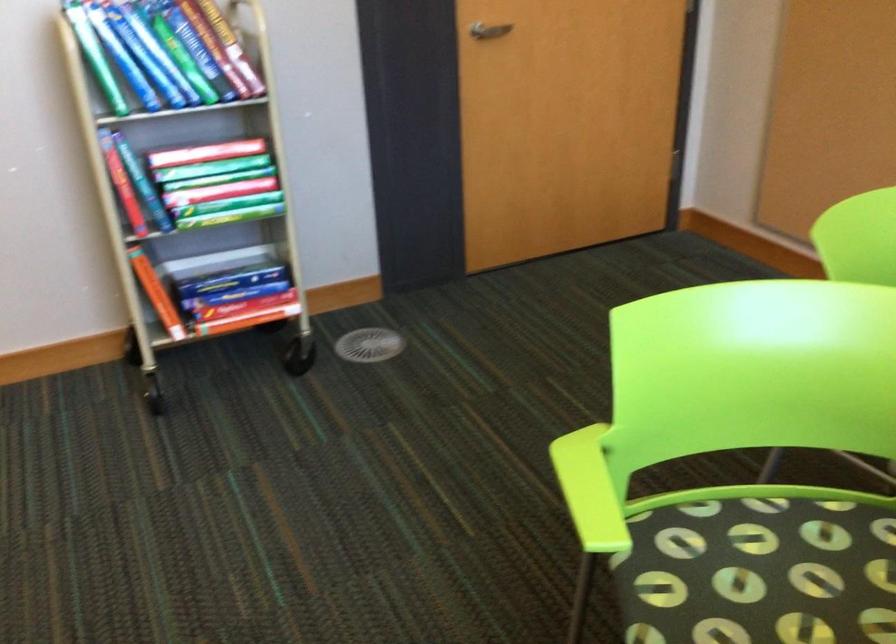
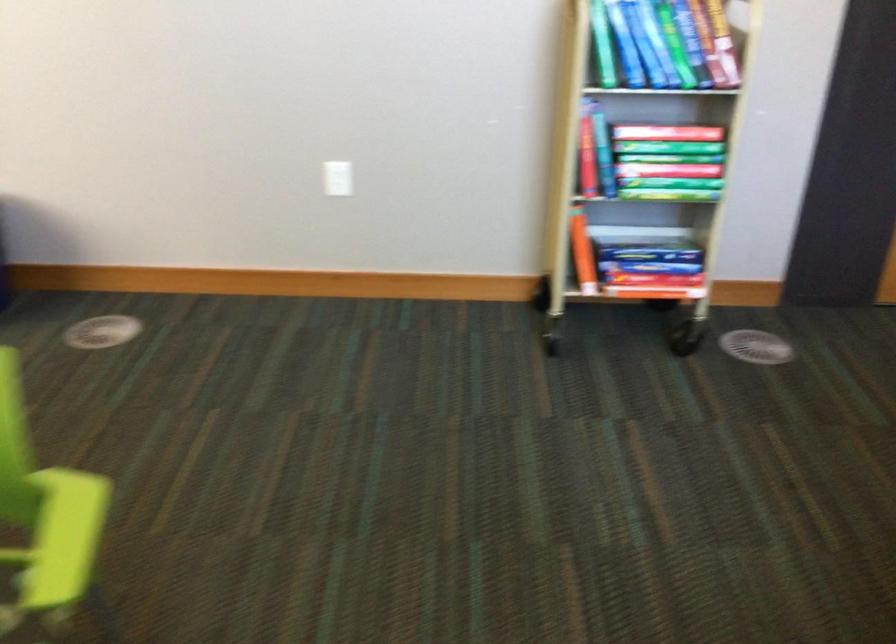
Question: The camera is either moving clockwise (left) or counter-clockwise (right) around the object. The first image is from the beginning of the video and the second image is from the end. Is the camera moving left or right when shooting the video?

Choices:
 (A) Left
 (B) Right

Answer: (B)